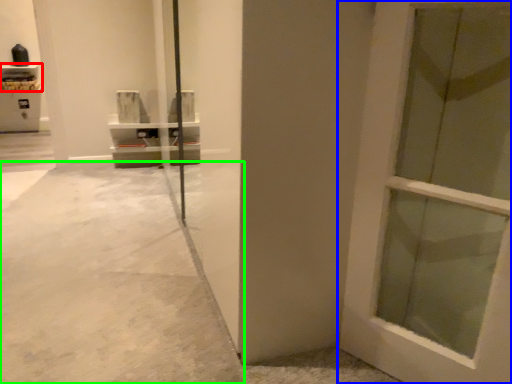
Question: Which object is the farthest from shelf (highlighted by a red box)? Choose among these: door (highlighted by a blue box) or concrete (highlighted by a green box).

Choices:
 (A) door
 (B) concrete

Answer: (A)